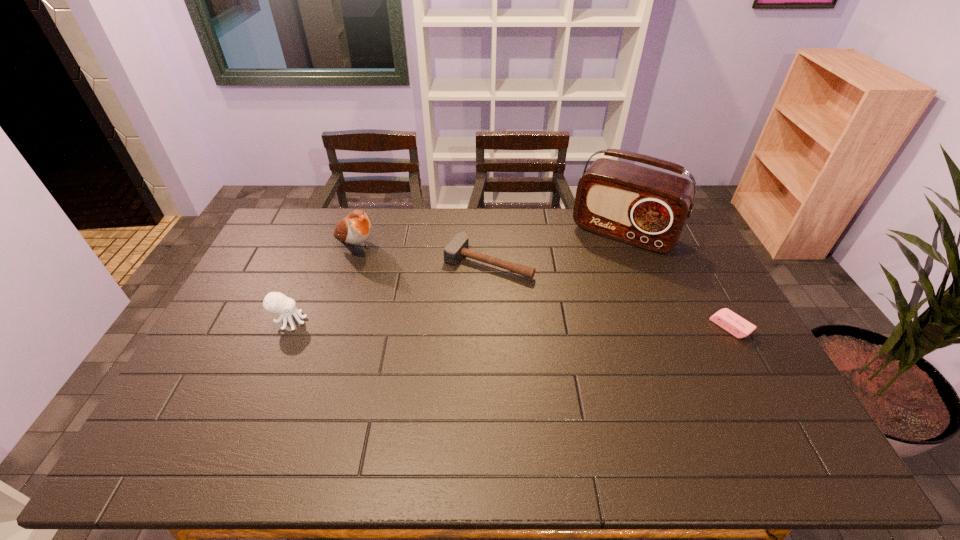
Where is `the third shortest object`? The width and height of the screenshot is (960, 540). the third shortest object is located at coordinates (275, 302).

This screenshot has width=960, height=540. Find the location of `eraser`. eraser is located at coordinates (728, 320).

What are the coordinates of `radio receiver` in the screenshot? It's located at (647, 208).

The height and width of the screenshot is (540, 960). I want to click on the fourth shortest object, so click(x=355, y=228).

Where is `hammer`? This screenshot has height=540, width=960. hammer is located at coordinates (458, 247).

Where is `the second shortest object`? the second shortest object is located at coordinates (458, 247).

Identify the location of vacant space positioned on the front-facing side of the third tallest object. This screenshot has width=960, height=540. (413, 321).

Locate an element on the screen. This screenshot has height=540, width=960. vacant region located on the front of the eraser is located at coordinates (753, 368).

Find the location of a particular element. vacant area situated 0.220m on the front panel of the tallest object is located at coordinates (583, 293).

You are a GUI agent. You are given a task and a screenshot of the screen. Output one action in this format:
    pyautogui.click(x=<x>, y=<y>)
    Task: Click on the free spot located 0.260m on the front panel of the tallest object
    This screenshot has width=960, height=540.
    Given the screenshot: What is the action you would take?
    pyautogui.click(x=578, y=301)